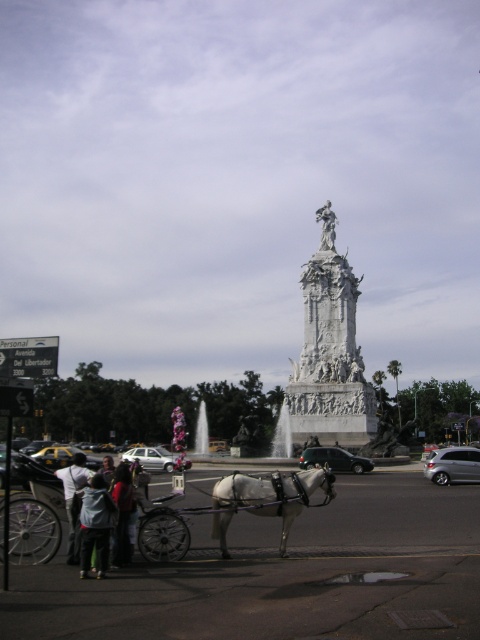
Question: Among these points, which one is nearest to the camera?

Choices:
 (A) (336, 396)
 (B) (120, 490)
 (C) (96, 481)
 (D) (336, 460)

Answer: (C)

Question: In this image, where is satin silver sedan at lower right located relative to white marble statue at upper center?

Choices:
 (A) left
 (B) right

Answer: (B)

Question: Is satin silver sedan at lower right to the left of yellow matte taxi at left from the viewer's perspective?

Choices:
 (A) no
 (B) yes

Answer: (A)

Question: Which object is closer to the camera taking this photo?

Choices:
 (A) yellow matte taxi at left
 (B) white leather horse at center
 (C) white cotton shirt at lower left

Answer: (B)

Question: Which point appears farthest from the camera in this image?

Choices:
 (A) (164, 458)
 (B) (326, 202)
 (C) (284, 480)

Answer: (B)

Question: Observing the image, what is the correct spatial positioning of white marble monument at center in reference to satin silver sedan at lower right?

Choices:
 (A) below
 (B) above

Answer: (B)